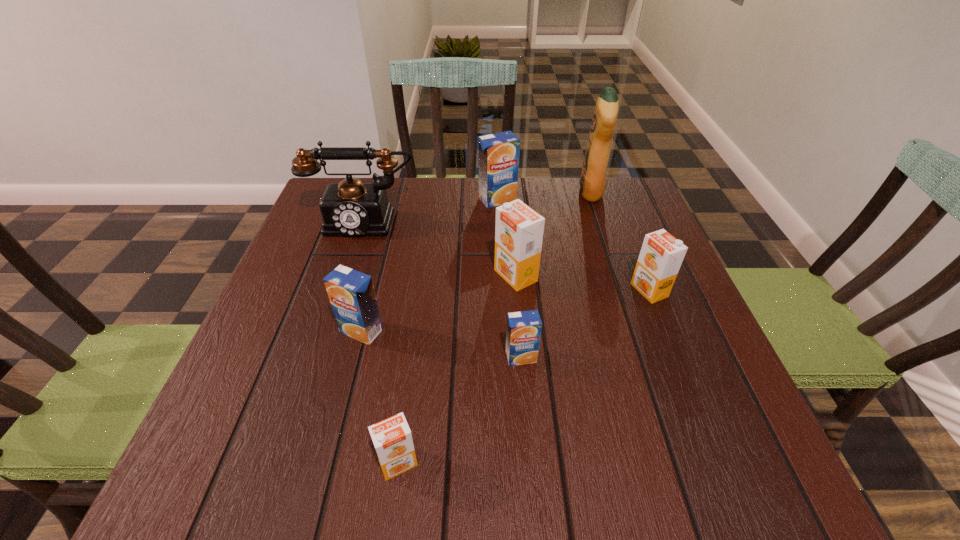
Identify the location of the second nearest object. (523, 333).

You are a GUI agent. You are given a task and a screenshot of the screen. Output one action in this format:
    pyautogui.click(x=<x>, y=<y>)
    Task: Click on the smallest blue orange_juice
    The height and width of the screenshot is (540, 960).
    Given the screenshot: What is the action you would take?
    pyautogui.click(x=523, y=333)

Identify the location of the smallest orange orange juice. (392, 438).

I want to click on the third object from left to right, so click(x=392, y=438).

Where is `free spot located on the label of the detergent`? free spot located on the label of the detergent is located at coordinates (536, 192).

Locate an element on the screen. The image size is (960, 540). vacant space located on the label of the detergent is located at coordinates (493, 192).

Find the location of a particular element. free space located on the label of the detergent is located at coordinates (458, 192).

At what (x,y) coordinates should I click in order to perform the action: click on free point located on the front of the telephone at the rotary dial. Please return your answer as a coordinate pair (x, y). This screenshot has width=960, height=540. Looking at the image, I should click on click(348, 267).

The width and height of the screenshot is (960, 540). Identify the location of vacant space situated on the left of the biggest blue orange_juice. (351, 199).

The height and width of the screenshot is (540, 960). I want to click on vacant space located 0.400m on the left of the biggest orange orange juice, so click(316, 276).